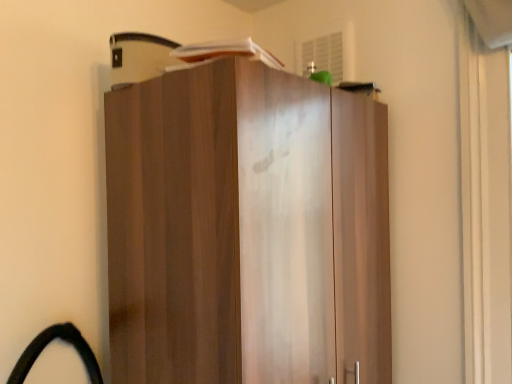
This screenshot has height=384, width=512. What are the coordinates of `wooden cabinet at center` in the screenshot? It's located at (247, 229).

What do you see at coordinates (247, 229) in the screenshot? I see `wooden cabinet at center` at bounding box center [247, 229].

Where is `wooden cabinet at center`? wooden cabinet at center is located at coordinates (247, 229).